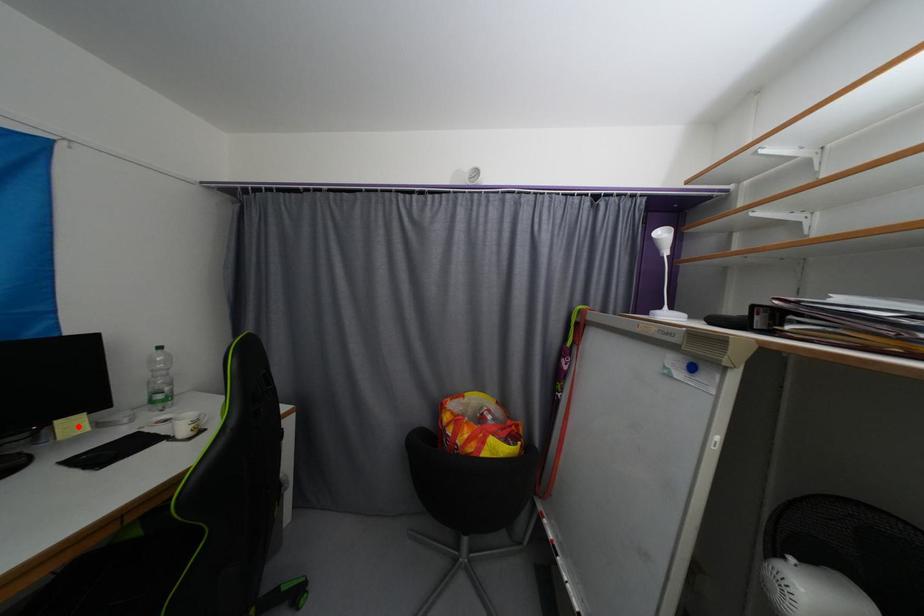
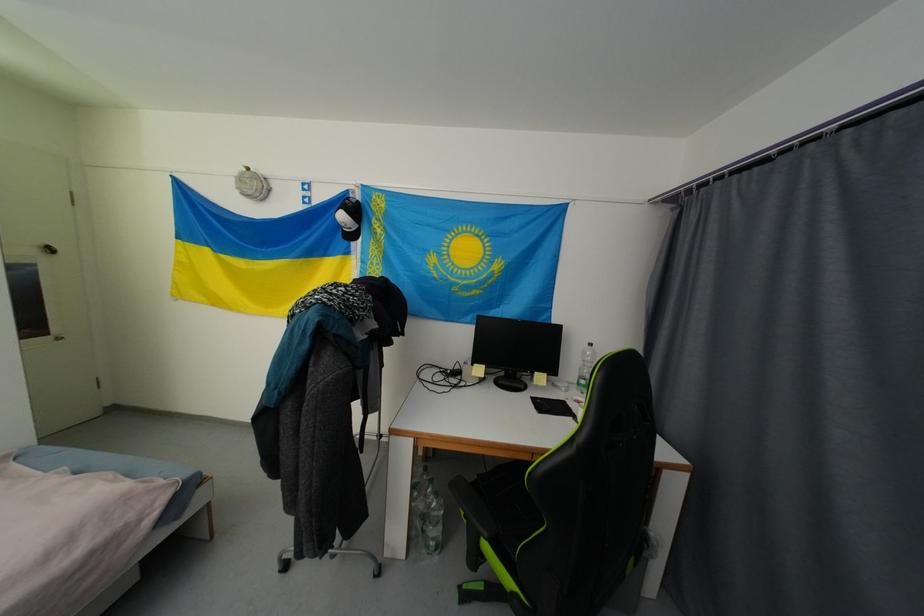
Question: I am providing you with two images of the same scene from different viewpoints. A red point is marked on the first image. Is the red point's position out of view in image 2?

Choices:
 (A) Yes
 (B) No

Answer: (B)